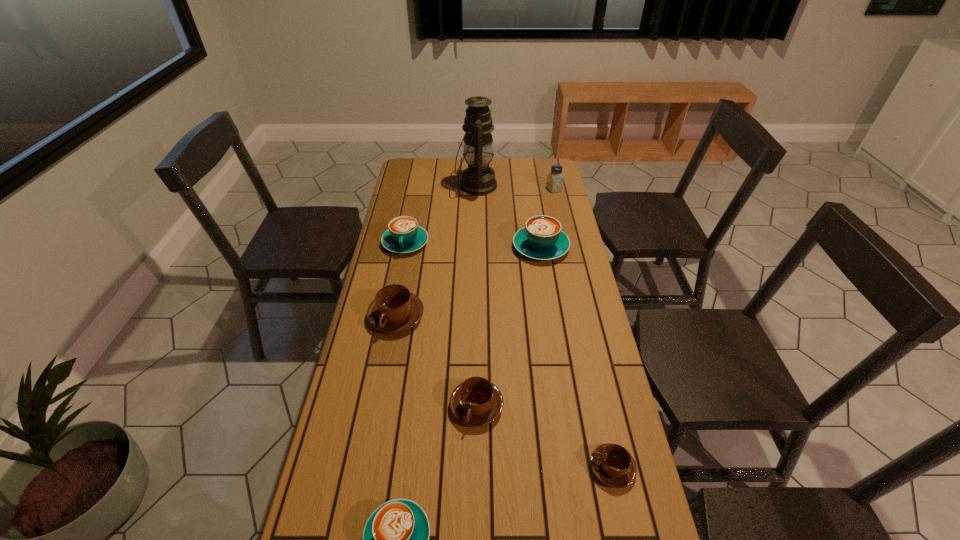
Locate an element on the screen. This screenshot has height=540, width=960. vacant space located 0.390m on the front of the tallest object is located at coordinates [x=475, y=260].

The width and height of the screenshot is (960, 540). Identify the location of free space located 0.130m on the front of the saltshaker. (559, 210).

Identify the location of vacant space located with the handle on the right side of the biggest turquoise cappuccino. (533, 196).

Where is `vacant position located with the handle on the right side of the biggest turquoise cappuccino`? This screenshot has width=960, height=540. vacant position located with the handle on the right side of the biggest turquoise cappuccino is located at coordinates (531, 187).

At what (x,y) coordinates should I click in order to perform the action: click on vacant space situated with the handle on the right side of the biggest turquoise cappuccino. Please return your answer as a coordinate pair (x, y). The image size is (960, 540). Looking at the image, I should click on (536, 214).

You are a GUI agent. You are given a task and a screenshot of the screen. Output one action in this format:
    pyautogui.click(x=<x>, y=<y>)
    Task: Click on the vacant space located 0.140m on the side of the leftmost brown cappuccino with the handle
    This screenshot has height=540, width=960.
    Given the screenshot: What is the action you would take?
    pyautogui.click(x=386, y=376)

Locate an element on the screen. free location located with the handle on the right side of the second smallest turquoise cappuccino is located at coordinates [387, 337].

What are the coordinates of `blank space located on the side of the fourth farthest cappuccino with the handle` in the screenshot? It's located at (476, 449).

Where is `vacant region located 0.300m on the side of the smallest brown cappuccino with the handle`? The height and width of the screenshot is (540, 960). vacant region located 0.300m on the side of the smallest brown cappuccino with the handle is located at coordinates (467, 468).

In order to click on vacant space situated 0.270m on the side of the smallest brown cappuccino with the handle in this screenshot , I will do `click(479, 468)`.